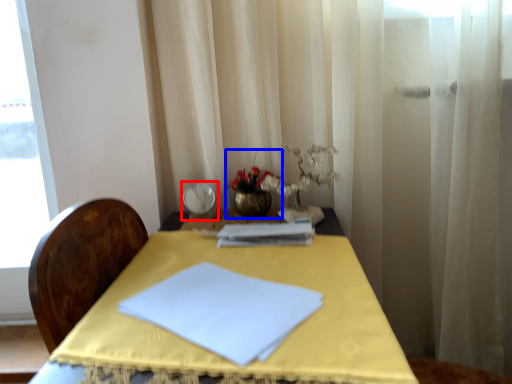
Question: Among these objects, which one is farthest to the camera, tableware (highlighted by a red box) or floral arrangement (highlighted by a blue box)?

Choices:
 (A) tableware
 (B) floral arrangement

Answer: (A)